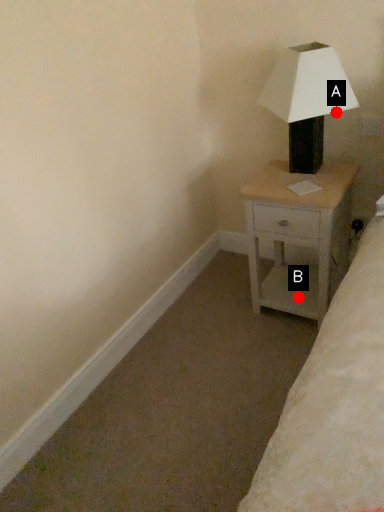
Question: Two points are circled on the image, labeled by A and B beside each circle. Among these points, which one is farthest from the camera?

Choices:
 (A) A is further
 (B) B is further

Answer: (B)